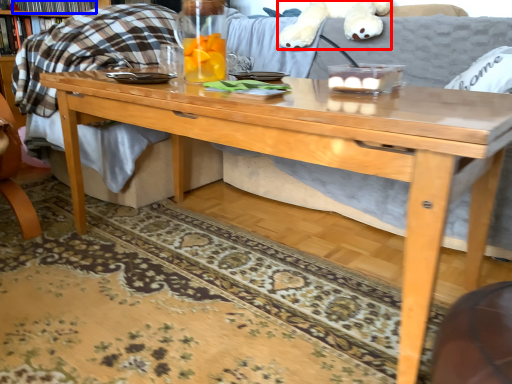
Question: Which object appears closest to the camera in this image, animal (highlighted by a red box) or book (highlighted by a blue box)?

Choices:
 (A) animal
 (B) book

Answer: (A)